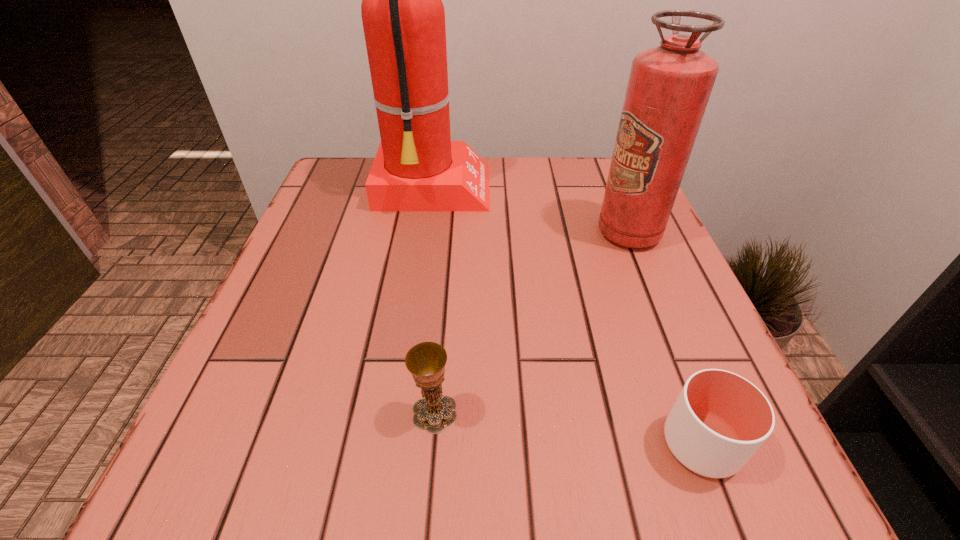
Locate an element on the screen. The height and width of the screenshot is (540, 960). vacant space situated 0.130m on the right of the chalice is located at coordinates point(548,412).

In order to click on vacant space situated 0.110m on the back of the cup in this screenshot , I will do `click(664, 349)`.

Where is `object located in the far edge section of the desktop`? object located in the far edge section of the desktop is located at coordinates (417, 167).

Locate an element on the screen. The width and height of the screenshot is (960, 540). object located at the near edge is located at coordinates (720, 419).

Where is `object that is at the left edge`? This screenshot has width=960, height=540. object that is at the left edge is located at coordinates (417, 167).

I want to click on fire extinguisher situated at the right edge, so click(x=669, y=86).

Identify the location of cup that is at the right edge. (720, 419).

At what (x,y) coordinates should I click in order to perform the action: click on object located at the far left corner. Please return your answer as a coordinate pair (x, y). The image size is (960, 540). Looking at the image, I should click on click(417, 167).

I want to click on object that is at the near right corner, so click(720, 419).

The image size is (960, 540). In the image, there is a desktop. Find the location of `free space at the far edge`. free space at the far edge is located at coordinates (514, 194).